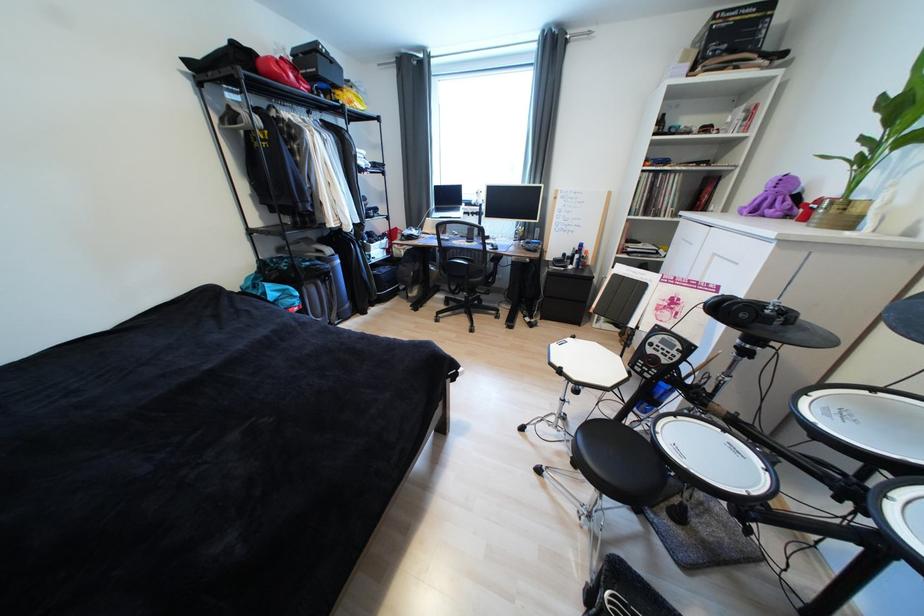
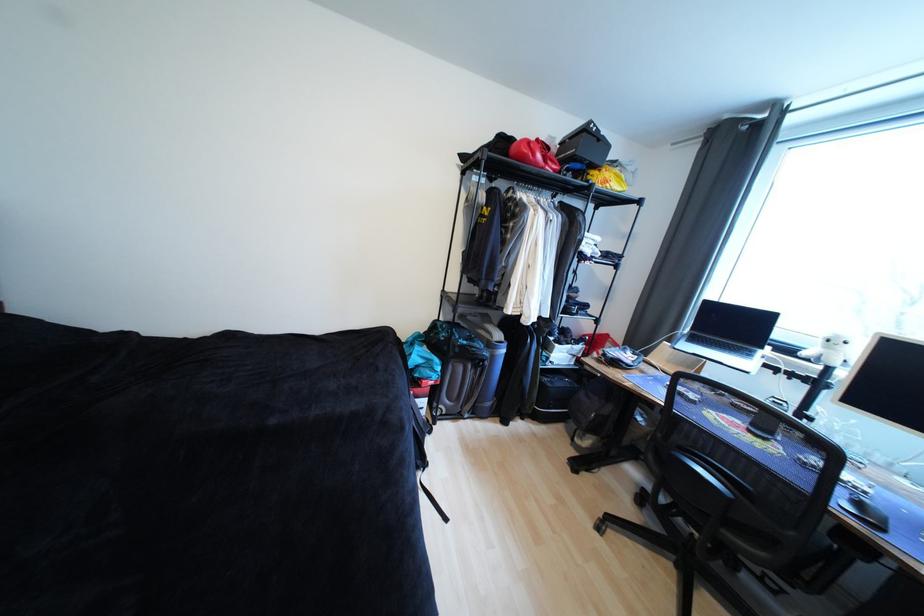
In the second image, find the point that corresponds to [481,206] in the first image.

(812, 361)